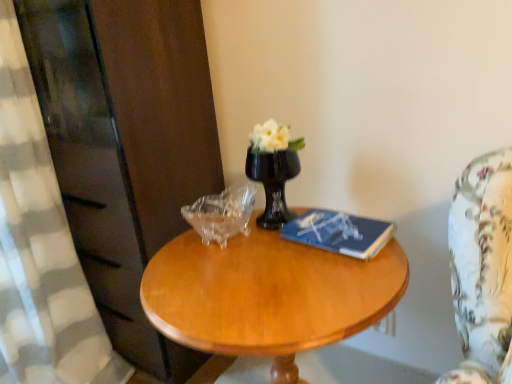
Question: Is transparent glass piggy bank at center next to black glass vase at center?

Choices:
 (A) yes
 (B) no

Answer: (B)

Question: Is transparent glass piggy bank at center shorter than black glass vase at center?

Choices:
 (A) yes
 (B) no

Answer: (A)

Question: Does transparent glass piggy bank at center lie in front of black glass vase at center?

Choices:
 (A) yes
 (B) no

Answer: (A)

Question: From a real-world perspective, is transparent glass piggy bank at center on top of black glass vase at center?

Choices:
 (A) yes
 (B) no

Answer: (B)

Question: Is transparent glass piggy bank at center not within black glass vase at center?

Choices:
 (A) no
 (B) yes

Answer: (B)

Question: Is transparent glass piggy bank at center positioned with its back to black glass vase at center?

Choices:
 (A) yes
 (B) no

Answer: (B)

Question: Is transparent glass piggy bank at center further to the viewer compared to blue matte book at center?

Choices:
 (A) yes
 (B) no

Answer: (A)

Question: Is transparent glass piggy bank at center taller than blue matte book at center?

Choices:
 (A) no
 (B) yes

Answer: (B)

Question: From a real-world perspective, is transparent glass piggy bank at center on top of blue matte book at center?

Choices:
 (A) yes
 (B) no

Answer: (A)

Question: Is transparent glass piggy bank at center aimed at blue matte book at center?

Choices:
 (A) no
 (B) yes

Answer: (A)

Question: Can you confirm if transparent glass piggy bank at center is bigger than blue matte book at center?

Choices:
 (A) no
 (B) yes

Answer: (B)

Question: Does transparent glass piggy bank at center have a smaller size compared to blue matte book at center?

Choices:
 (A) yes
 (B) no

Answer: (B)

Question: Is light brown wood coffee table at center next to black glass vase at center and touching it?

Choices:
 (A) no
 (B) yes

Answer: (A)